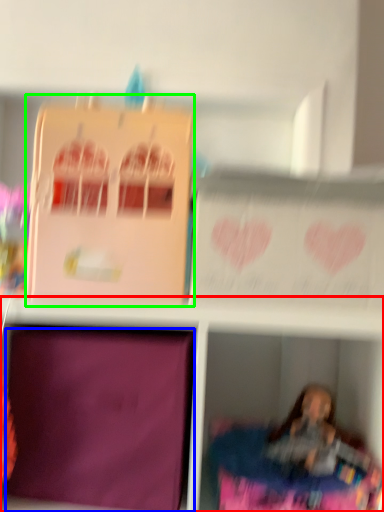
Question: Which object is positioned closest to shelf (highlighted by a red box)? Select from cardboard box (highlighted by a blue box) and cardboard box (highlighted by a green box).

Choices:
 (A) cardboard box
 (B) cardboard box

Answer: (A)